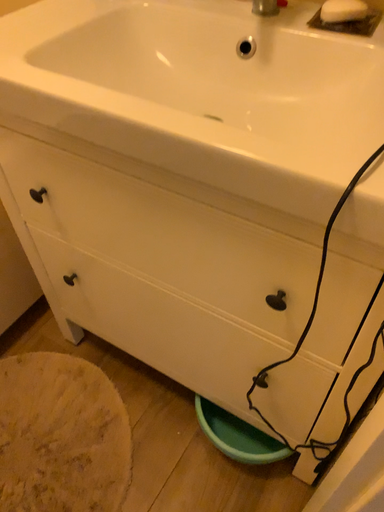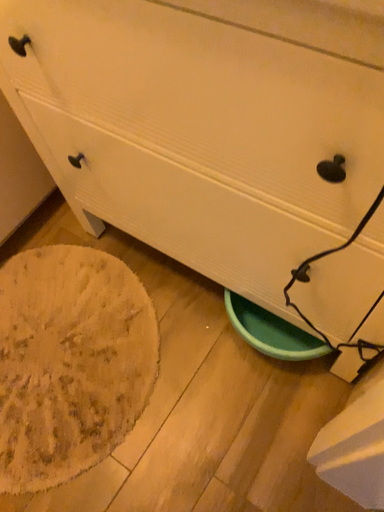
Question: Which way did the camera rotate in the video?

Choices:
 (A) rotated upward
 (B) rotated downward

Answer: (B)